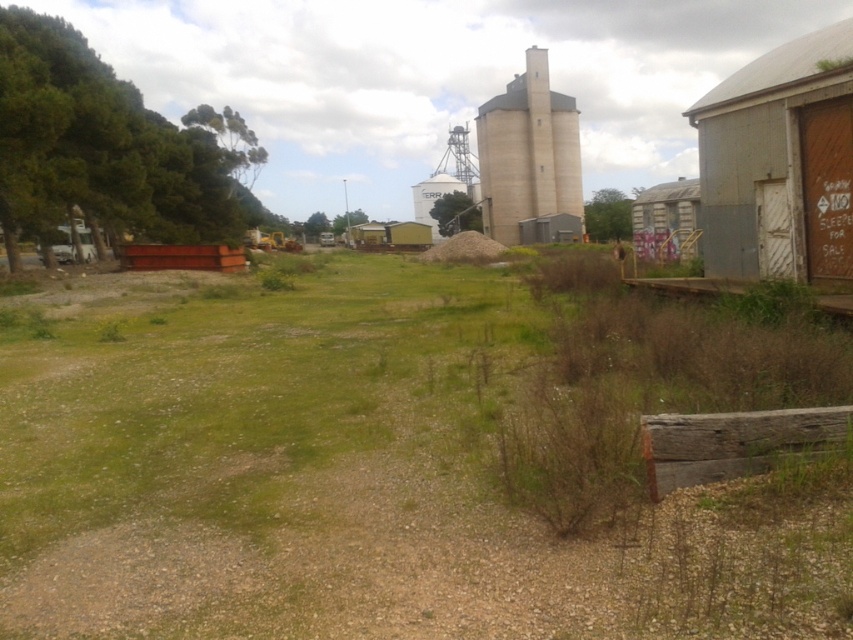
Can you confirm if green grass at center is bigger than beige concrete silo at center?

Result: No.

Which of these two, green grass at center or beige concrete silo at center, stands shorter?

With less height is green grass at center.

Does point (107, 611) come behind point (538, 65)?

No, (107, 611) is in front of (538, 65).

This screenshot has height=640, width=853. In order to click on green grass at center in this screenshot , I will do `click(403, 467)`.